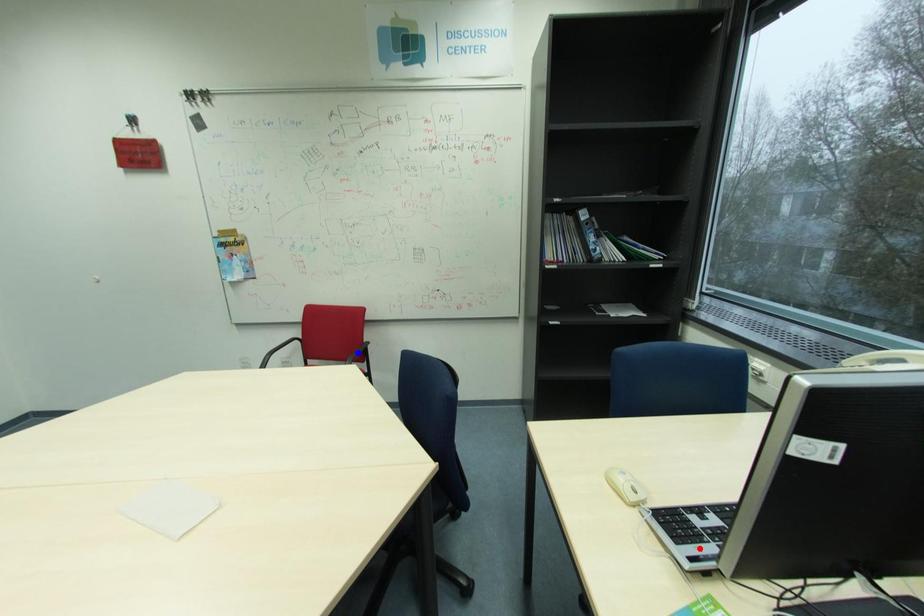
Question: In the image, two points are highlighted. Which point is nearer to the camera? Reply with the corresponding letter.

Choices:
 (A) blue point
 (B) red point

Answer: (B)